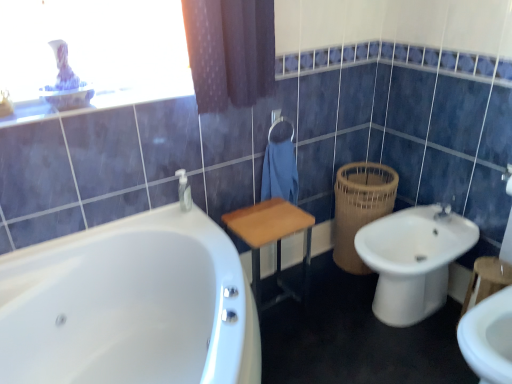
You are a GUI agent. You are given a task and a screenshot of the screen. Output one action in this format:
    pyautogui.click(x=<x>, y=<y>)
    Task: Click on the free space behind wooden table at center
    The width and height of the screenshot is (512, 384).
    Given the screenshot: What is the action you would take?
    (x=290, y=274)